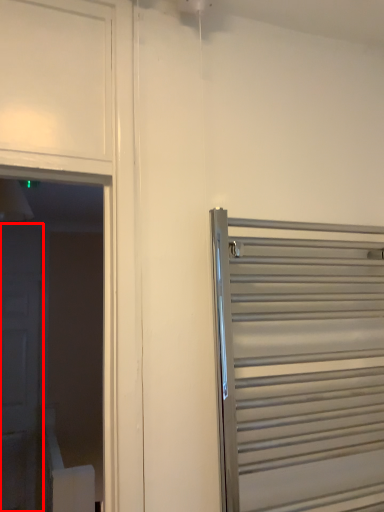
Question: In this image, where is door (annotated by the red box) located relative to door?

Choices:
 (A) left
 (B) right

Answer: (A)